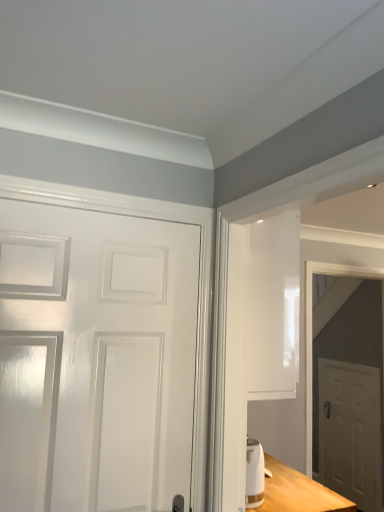
Question: Considering the positions of white glossy door at left, which is the second door in bottom-to-top order, and white matte door at right, which is counted as the second door, starting from the top, in the image, is white glossy door at left, which is the second door in bottom-to-top order, bigger or smaller than white matte door at right, which is counted as the second door, starting from the top,?

Choices:
 (A) small
 (B) big

Answer: (B)

Question: From a real-world perspective, is white glossy door at left, which is the second door in bottom-to-top order, positioned above or below white matte door at right, the 2th door positioned from the front?

Choices:
 (A) above
 (B) below

Answer: (A)

Question: Which of these objects is positioned closest to the white matte door at right, the second door positioned from the left?

Choices:
 (A) white glossy door at left, which is the second door in bottom-to-top order
 (B) white glossy door at right

Answer: (B)

Question: Which of these objects is positioned farthest from the white matte door at right, arranged as the 1th door when ordered from the bottom?

Choices:
 (A) white glossy door at right
 (B) white glossy door at left, which is the second door in bottom-to-top order

Answer: (B)